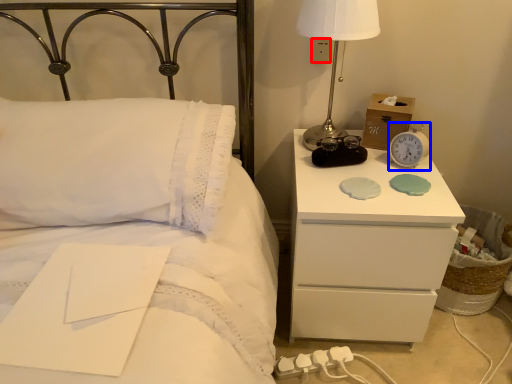
Question: Which object is further to the camera taking this photo, electric outlet (highlighted by a red box) or alarm clock (highlighted by a blue box)?

Choices:
 (A) electric outlet
 (B) alarm clock

Answer: (A)